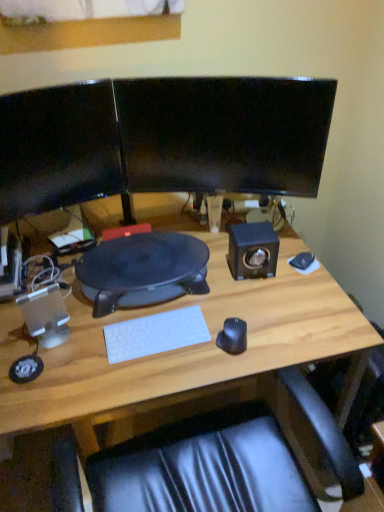
Where is `vacant area on top of black rubberized desk at center (from a real-world perspective)`? vacant area on top of black rubberized desk at center (from a real-world perspective) is located at coordinates (143, 256).